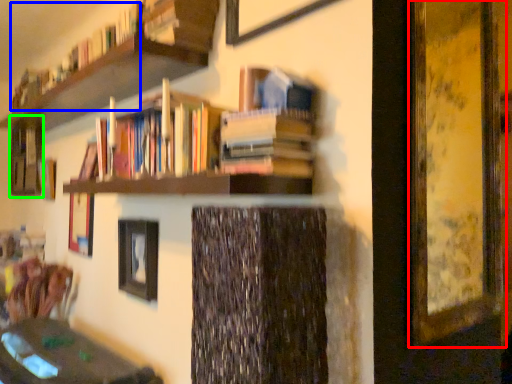
Question: Based on their relative distances, which object is nearer to picture frame (highlighted by a red box)? Choose from book (highlighted by a blue box) and shelf (highlighted by a green box).

Choices:
 (A) book
 (B) shelf

Answer: (A)